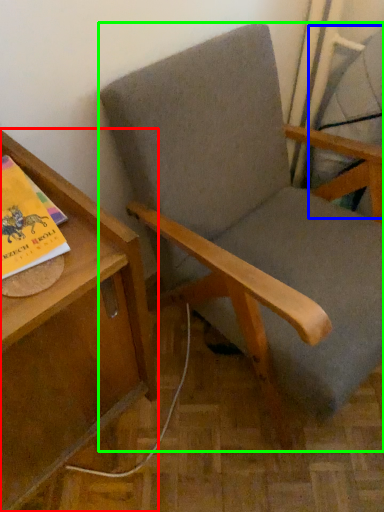
Question: Which is nearer to the table (highlighted by a red box)? swivel chair (highlighted by a blue box) or chair (highlighted by a green box).

Choices:
 (A) swivel chair
 (B) chair

Answer: (B)